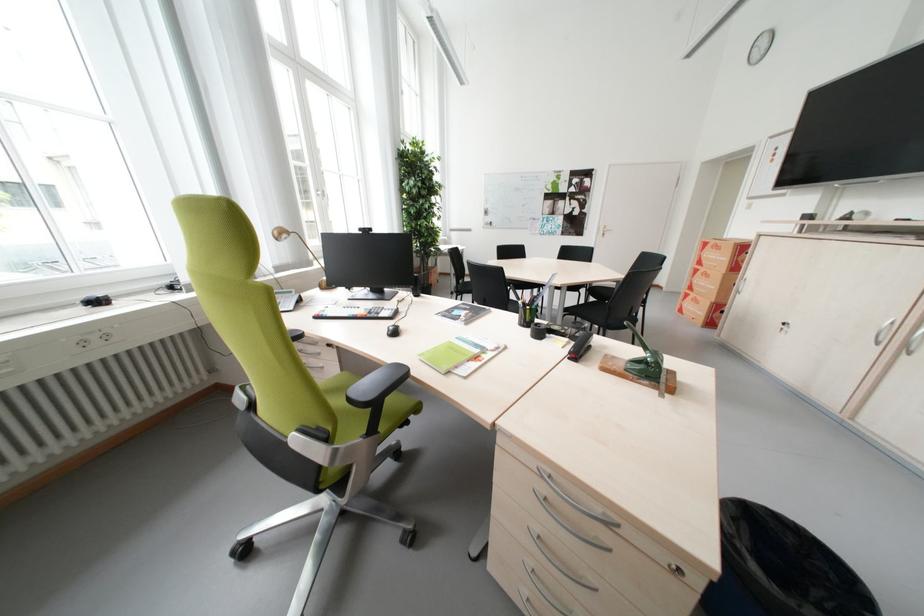
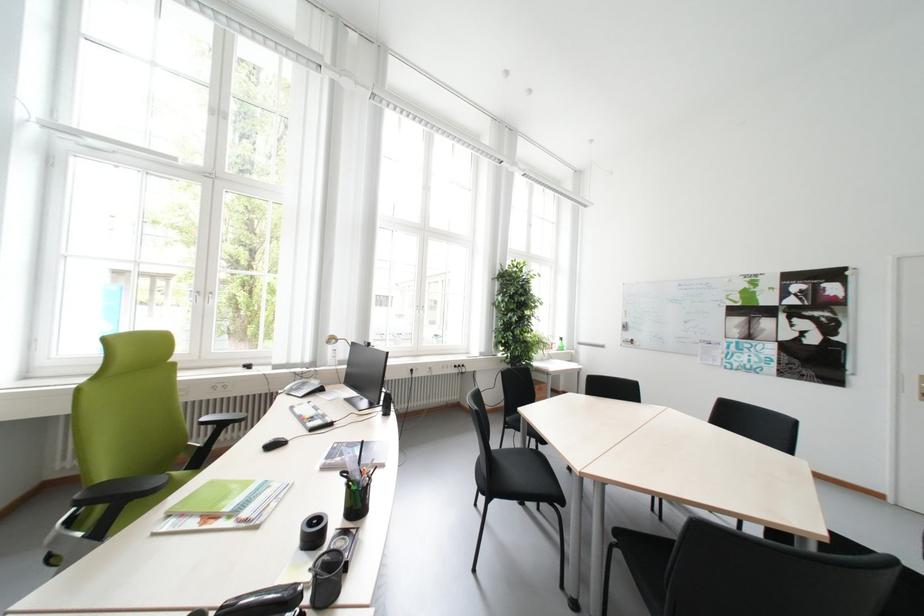
Find the pixel in the second image that matches (x=485, y=222) in the first image.

(621, 338)